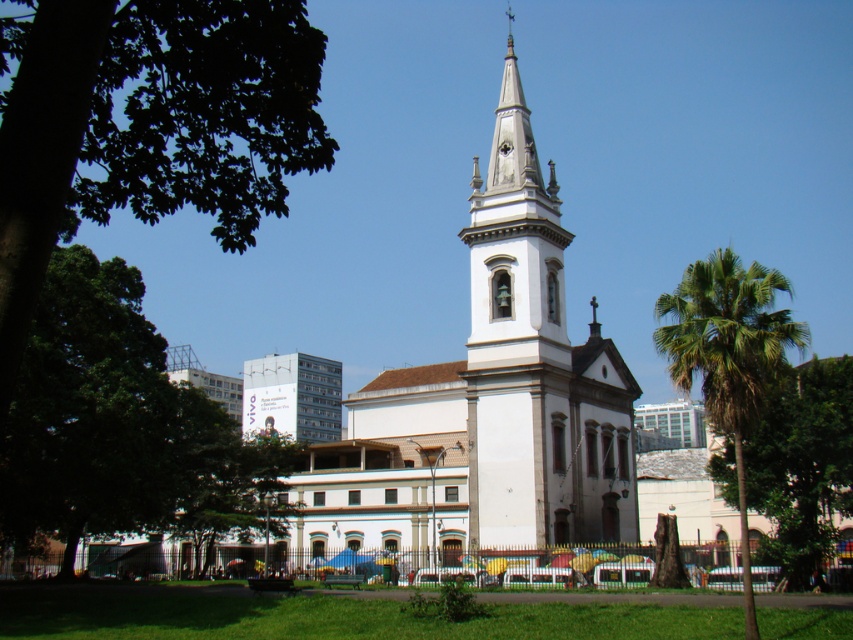
Question: Does white stone church at center appear on the left side of green leafy palm tree at right?

Choices:
 (A) no
 (B) yes

Answer: (B)

Question: Is white stone bell tower at center below green leafy palm tree at right?

Choices:
 (A) yes
 (B) no

Answer: (B)

Question: Is white stone church at center further to camera compared to green leafy tree at center?

Choices:
 (A) no
 (B) yes

Answer: (B)

Question: Which object is closer to the camera taking this photo?

Choices:
 (A) white stone church at center
 (B) green leafy palm tree at right
 (C) white stone bell tower at center

Answer: (B)

Question: Estimate the real-world distances between objects in this image. Which object is farther from the white stone bell tower at center?

Choices:
 (A) green leafy tree at lower left
 (B) white stone church at center
 (C) green leafy tree at center
 (D) green leafy palm tree at right

Answer: (A)

Question: Which object is positioned farthest from the green leafy tree at lower left?

Choices:
 (A) green leafy tree at center
 (B) white stone church at center
 (C) white stone bell tower at center
 (D) green leafy palm tree at right

Answer: (A)